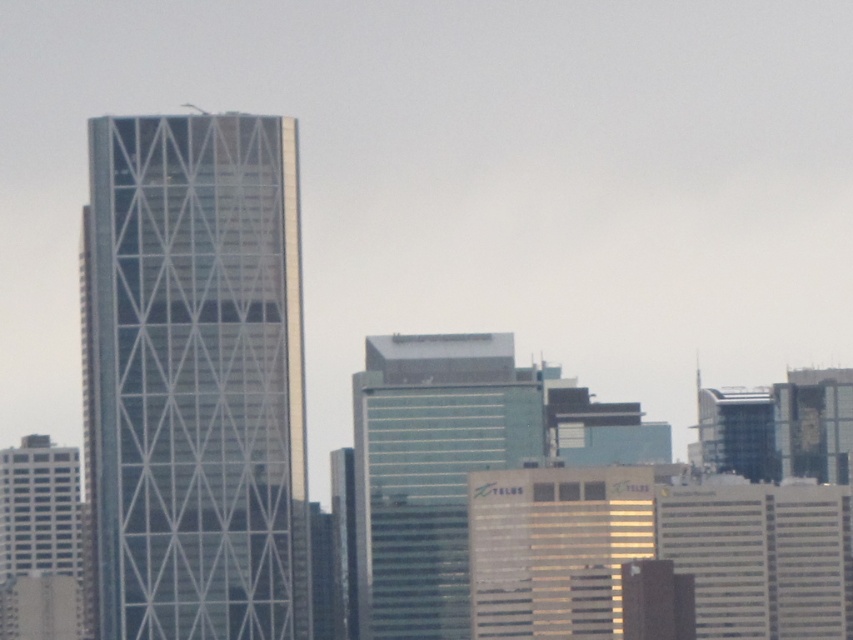
Question: Which of the following is the farthest from the observer?

Choices:
 (A) green glass building at center
 (B) metallic glass tower at left

Answer: (B)

Question: Can you confirm if metallic glass tower at left is positioned to the left of green glass building at center?

Choices:
 (A) yes
 (B) no

Answer: (A)

Question: Is metallic glass tower at left positioned behind green glass building at center?

Choices:
 (A) yes
 (B) no

Answer: (A)

Question: Which point is farther from the camera taking this photo?

Choices:
 (A) (305, 536)
 (B) (418, 500)

Answer: (A)

Question: Can you confirm if metallic glass tower at left is wider than green glass building at center?

Choices:
 (A) yes
 (B) no

Answer: (A)